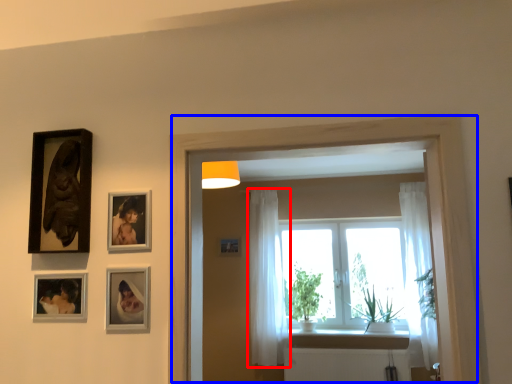
Question: Among these objects, which one is nearest to the camera, curtain (highlighted by a red box) or window frame (highlighted by a blue box)?

Choices:
 (A) curtain
 (B) window frame

Answer: (B)